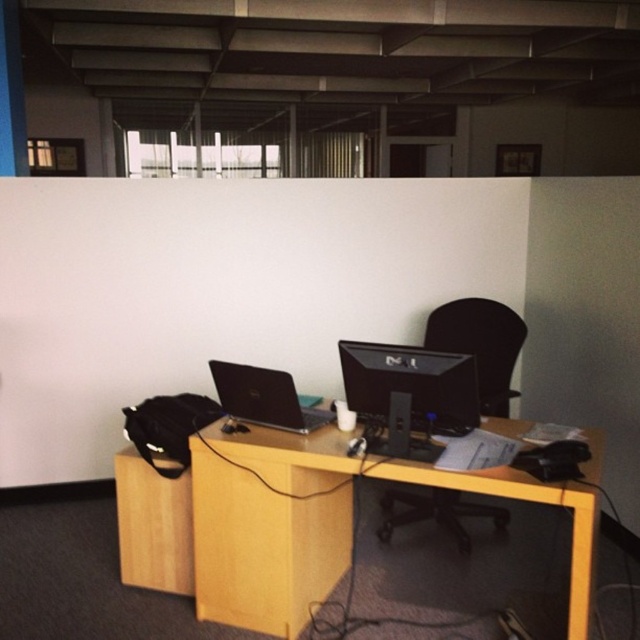
Question: Can you confirm if light wood/wooden computer desk at center is smaller than black glossy monitor at center?

Choices:
 (A) yes
 (B) no

Answer: (B)

Question: Considering the real-world distances, which object is farthest from the black glossy monitor at center?

Choices:
 (A) light wood/wooden computer desk at center
 (B) matte black laptop at center

Answer: (B)

Question: Is light wood/wooden computer desk at center in front of black glossy monitor at center?

Choices:
 (A) no
 (B) yes

Answer: (B)

Question: Which point is closer to the camera?

Choices:
 (A) (294, 488)
 (B) (282, 385)

Answer: (B)

Question: Can you confirm if light wood/wooden computer desk at center is positioned to the left of black glossy monitor at center?

Choices:
 (A) no
 (B) yes

Answer: (B)

Question: Considering the real-world distances, which object is farthest from the matte black laptop at center?

Choices:
 (A) black glossy monitor at center
 (B) light wood/wooden computer desk at center

Answer: (A)